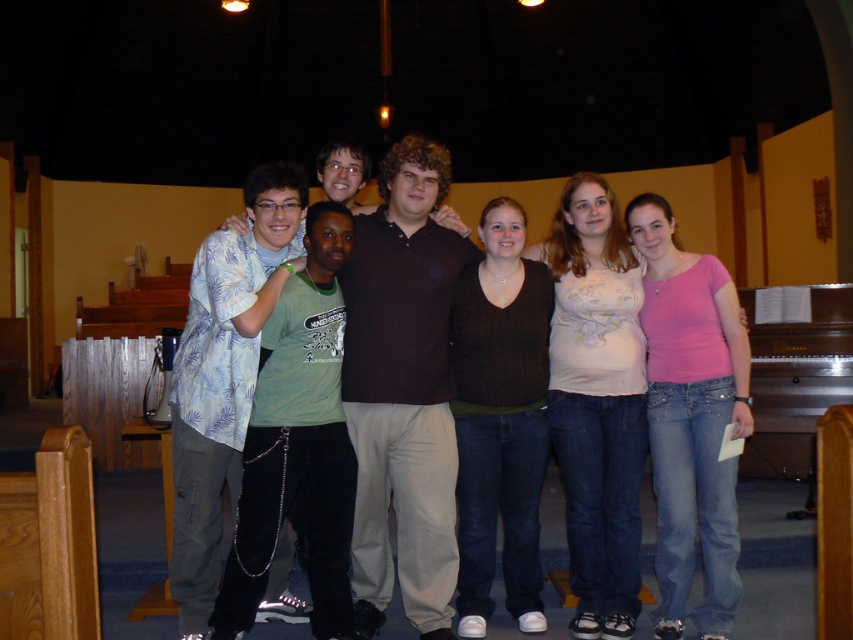
Is light pink cotton shirt at center bigger than dark brown sweater at center?

Yes.

Consider the image. Is light pink cotton shirt at center further to the viewer compared to dark brown sweater at center?

No, it is not.

Where is `light pink cotton shirt at center`? Image resolution: width=853 pixels, height=640 pixels. light pink cotton shirt at center is located at coordinates (596, 401).

Between light pink cotton shirt at center and pink matte shirt at center, which one appears on the left side from the viewer's perspective?

light pink cotton shirt at center is more to the left.

Does point (614, 410) come farther from viewer compared to point (672, 515)?

Yes, it is behind point (672, 515).

This screenshot has width=853, height=640. Find the location of `light pink cotton shirt at center`. light pink cotton shirt at center is located at coordinates (596, 401).

Between point (625, 579) and point (172, 534), which one is positioned behind?

Point (625, 579)

Who is higher up, light pink cotton shirt at center or light blue floral shirt at center?

Positioned higher is light blue floral shirt at center.

Identify the location of light pink cotton shirt at center. (596, 401).